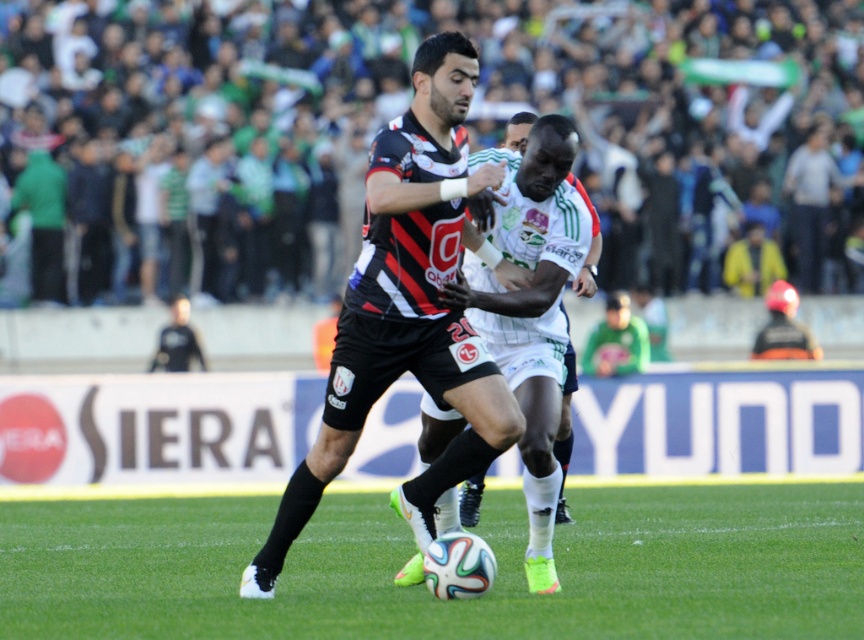
Question: Does green fabric crowd at upper center appear over green grass at center?

Choices:
 (A) no
 (B) yes

Answer: (B)

Question: Is the position of green fabric crowd at upper center more distant than that of green grass at center?

Choices:
 (A) yes
 (B) no

Answer: (A)

Question: Is green fabric crowd at upper center positioned before black matte jersey at center?

Choices:
 (A) no
 (B) yes

Answer: (A)

Question: Which of these objects is positioned farthest from the green fabric crowd at upper center?

Choices:
 (A) black matte soccer player at center
 (B) black matte jersey at center

Answer: (B)

Question: Among these points, which one is nearest to the camera?

Choices:
 (A) (415, 202)
 (B) (200, 588)
 (C) (564, 321)

Answer: (A)

Question: Which of these objects is positioned farthest from the green grass at center?

Choices:
 (A) black matte jersey at center
 (B) green fabric crowd at upper center
 (C) black matte soccer player at center

Answer: (B)